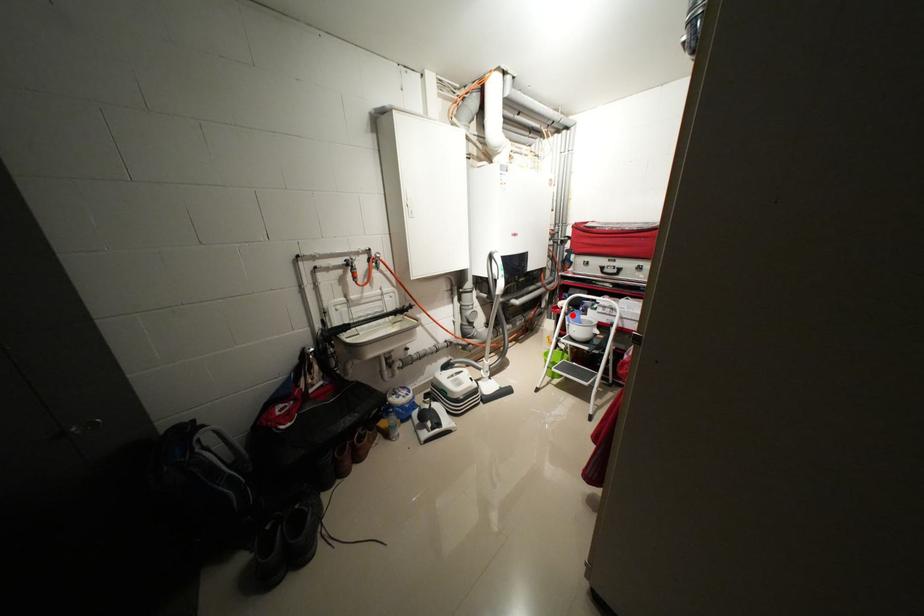
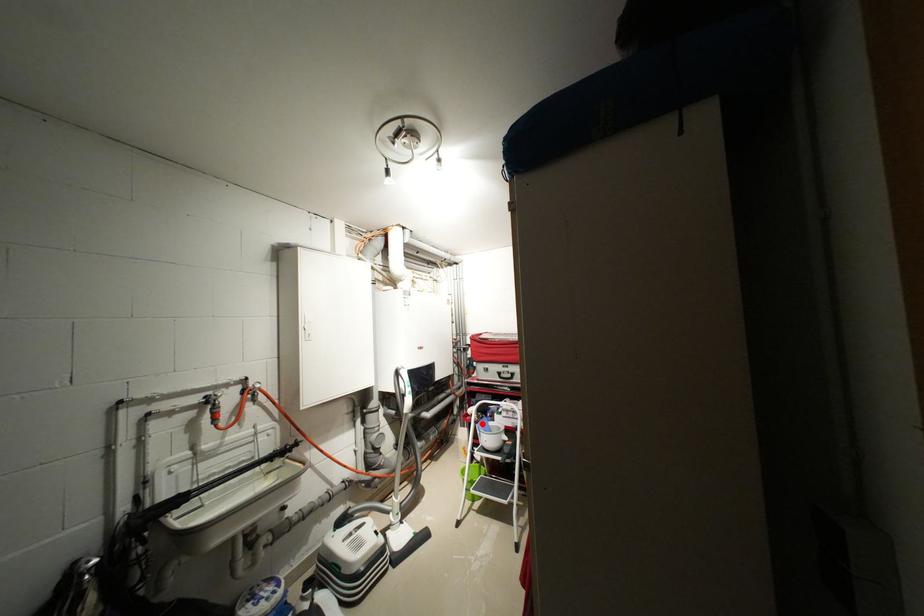
From the picture: I am providing you with two images of the same scene from different viewpoints. A red point is marked on the first image and another point is marked on the second image. Is the red point in image1 aligned with the point shown in image2?

Yes